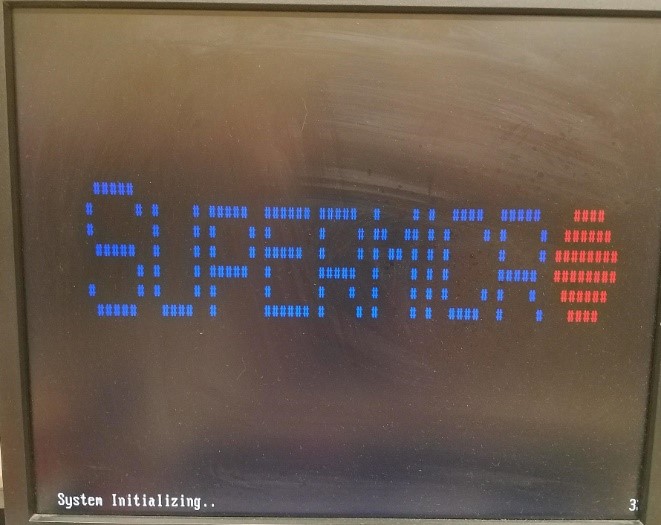
You are a GUI agent. You are given a task and a screenshot of the screen. Output one action in this format:
    pyautogui.click(x=<x>, y=<y>)
    Task: Click on the monitor
    
    Given the screenshot: What is the action you would take?
    (130, 421)